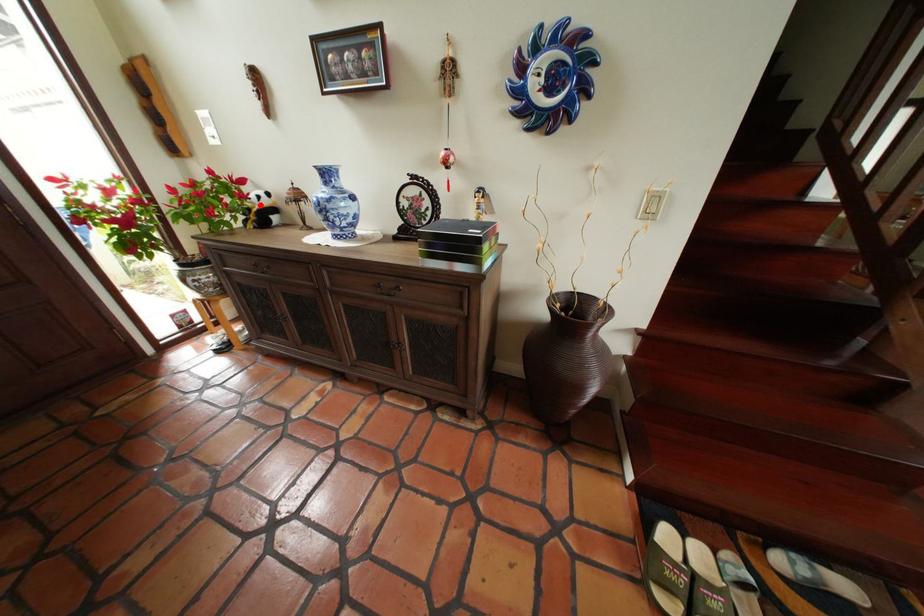
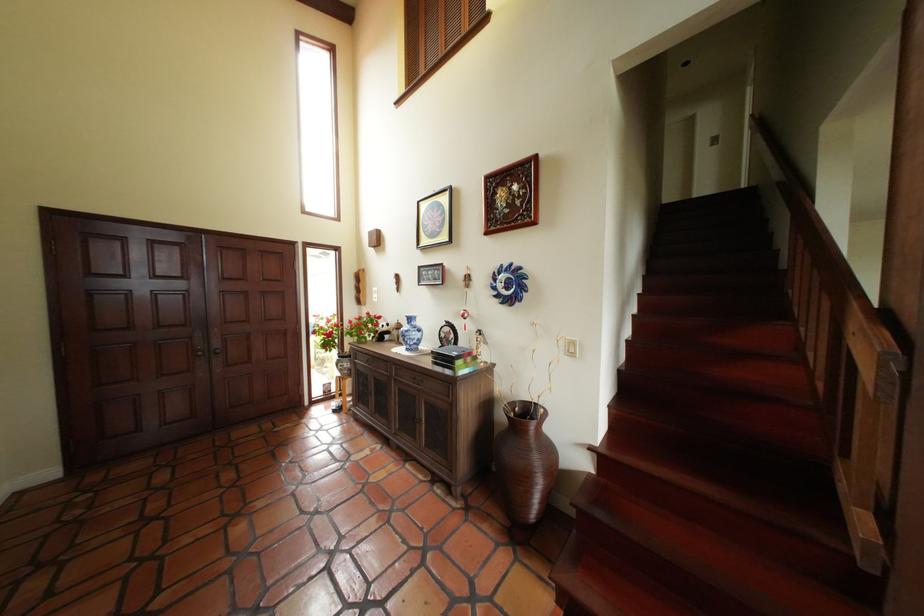
Question: I am providing you with two images of the same scene from different viewpoints. A red point is shown in image1. For the corresponding object point in image2, is it positioned nearer or farther from the camera?

Choices:
 (A) Nearer
 (B) Farther

Answer: (B)